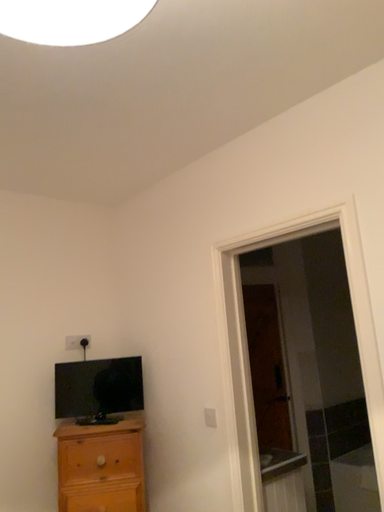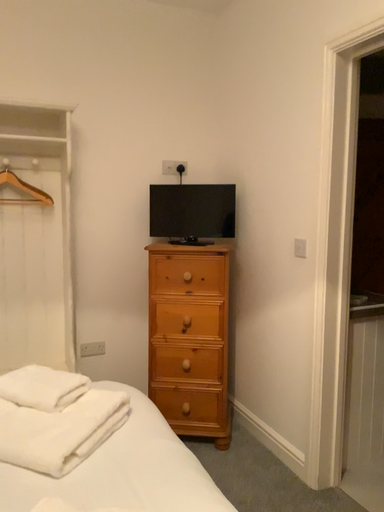
Question: Which way did the camera rotate in the video?

Choices:
 (A) rotated right
 (B) rotated left

Answer: (B)